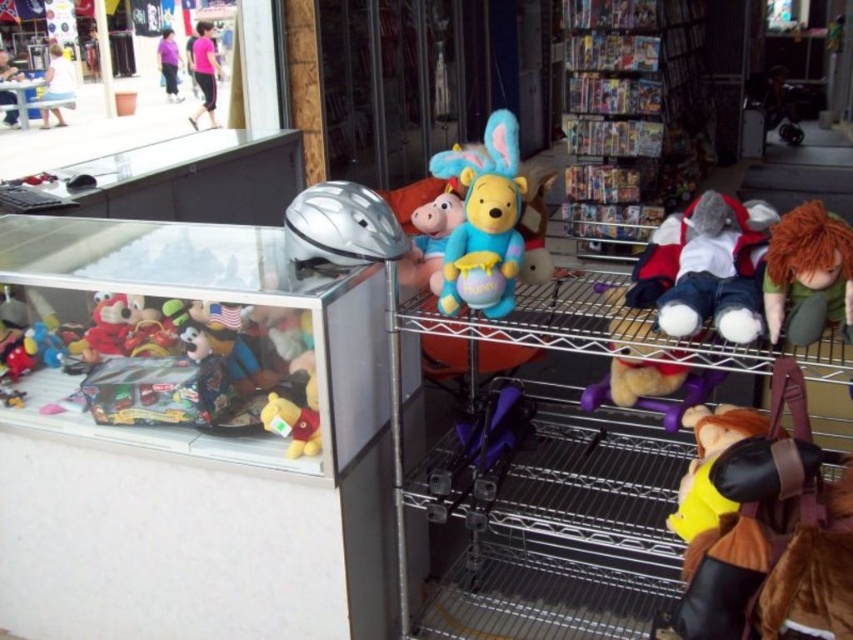
Question: Which of these objects is positioned farthest from the matte red plush toy at left?

Choices:
 (A) green felt doll at right
 (B) yellow plush toy at lower left

Answer: (A)

Question: Can you confirm if yellow plush toy at lower left is smaller than matte red plush toy at left?

Choices:
 (A) yes
 (B) no

Answer: (A)

Question: Does yellow plush toy at lower left have a larger size compared to matte red plush toy at left?

Choices:
 (A) yes
 (B) no

Answer: (B)

Question: Considering the real-world distances, which object is farthest from the yellow plush toy at lower left?

Choices:
 (A) matte blue plush at center
 (B) matte red plush toy at left
 (C) green felt doll at right
 (D) multicolored plush toys at left

Answer: (C)

Question: Does green felt doll at right appear on the right side of yellow plush toy at lower left?

Choices:
 (A) yes
 (B) no

Answer: (A)

Question: Based on their relative distances, which object is nearer to the matte blue plush at center?

Choices:
 (A) matte red plush toy at left
 (B) yellow plush toy at lower left
 (C) matte blue plush bear at center
 (D) white plush toy at center-right

Answer: (C)